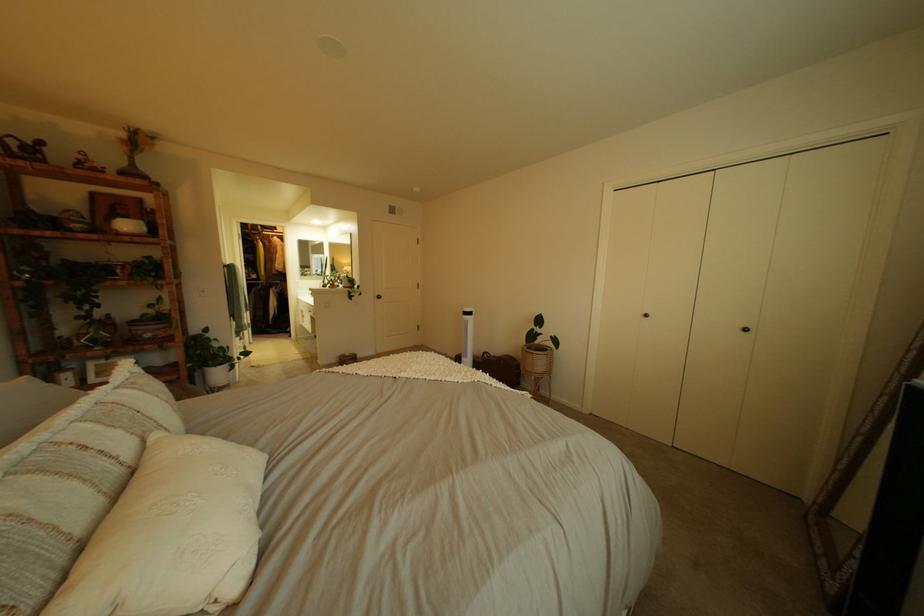
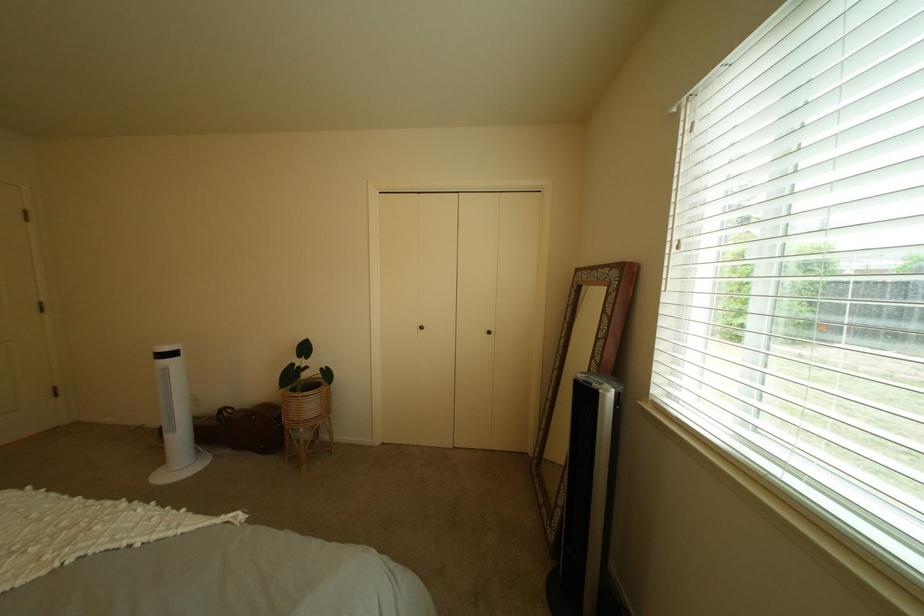
Question: Based on the continuous images, in which direction is the camera rotating? Reply with the corresponding letter.

Choices:
 (A) Left
 (B) Right
 (C) Up
 (D) Down

Answer: (B)